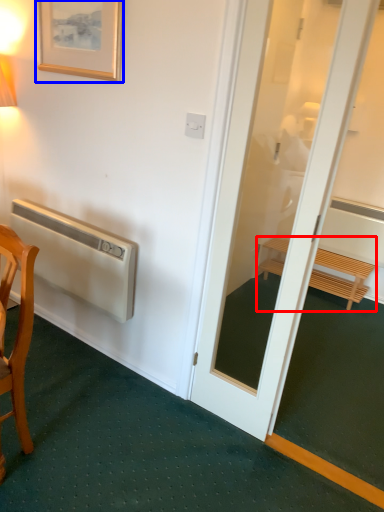
Question: Which point is further to the camera, furniture (highlighted by a red box) or picture frame (highlighted by a blue box)?

Choices:
 (A) furniture
 (B) picture frame

Answer: (A)